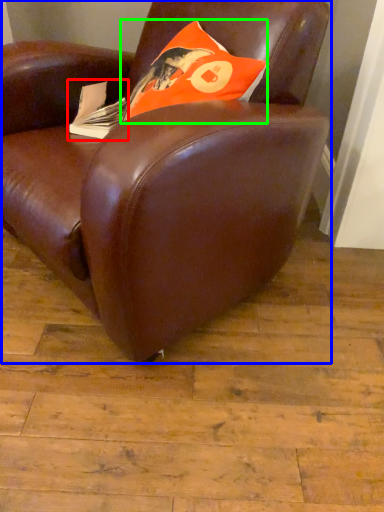
Question: Considering the real-world distances, which object is farthest from paperback book (highlighted by a red box)? chair (highlighted by a blue box) or throw pillow (highlighted by a green box)?

Choices:
 (A) chair
 (B) throw pillow

Answer: (A)